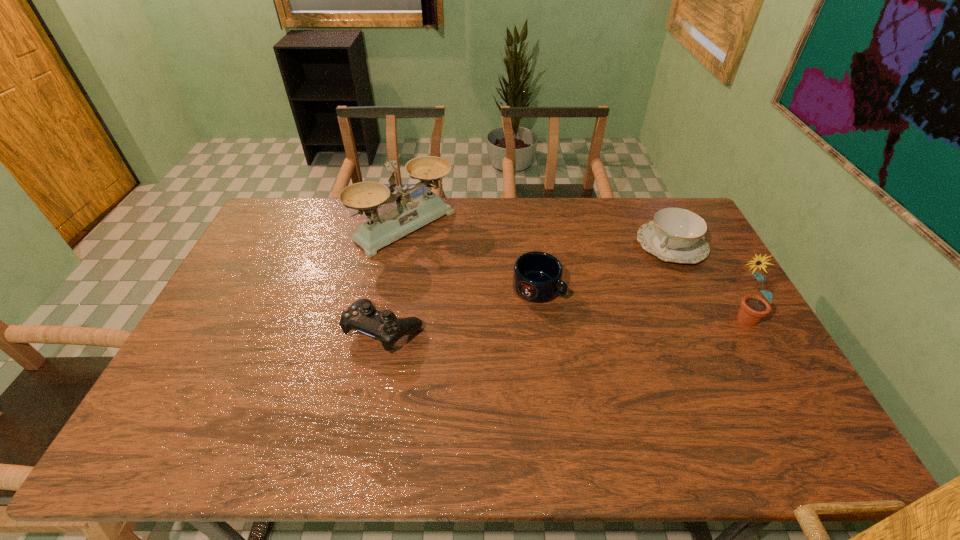
This screenshot has width=960, height=540. What are the coordinates of `vacant space located 0.090m on the front-facing side of the scale` in the screenshot? It's located at tap(453, 262).

Where is `vacant space located 0.250m on the front-facing side of the scale`? The image size is (960, 540). vacant space located 0.250m on the front-facing side of the scale is located at coordinates (487, 287).

Where is `vacant space located 0.300m with the handle on the side of the third object from right to left`? The width and height of the screenshot is (960, 540). vacant space located 0.300m with the handle on the side of the third object from right to left is located at coordinates (650, 351).

I want to click on free location located 0.150m with the handle on the side of the third object from right to left, so pyautogui.click(x=601, y=323).

Locate an element on the screen. vacant area located with the handle on the side of the third object from right to left is located at coordinates (x=592, y=318).

The image size is (960, 540). What are the coordinates of `chinaware at the far edge` in the screenshot? It's located at [676, 235].

Find the location of a particular element. scale that is at the far edge is located at coordinates (409, 215).

At what (x,y) coordinates should I click in order to perform the action: click on sunflower present at the right edge. Please return your answer as a coordinate pair (x, y). Looking at the image, I should click on (753, 308).

At what (x,y) coordinates should I click in order to perform the action: click on chinaware that is positioned at the right edge. Please return your answer as a coordinate pair (x, y). Image resolution: width=960 pixels, height=540 pixels. Looking at the image, I should click on (676, 235).

Where is `object located in the far right corner section of the desktop`? The width and height of the screenshot is (960, 540). object located in the far right corner section of the desktop is located at coordinates (676, 235).